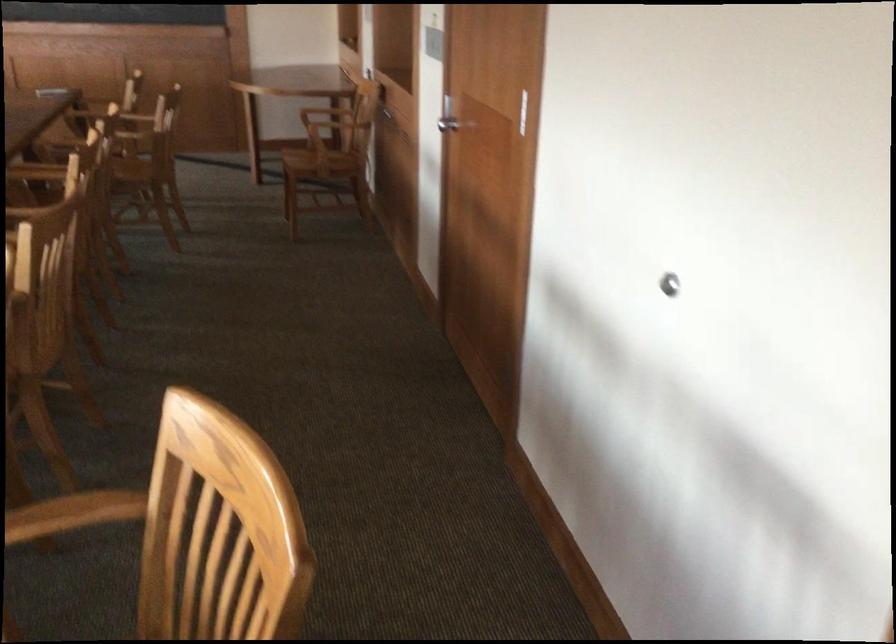
Image resolution: width=896 pixels, height=644 pixels. Describe the element at coordinates (321, 163) in the screenshot. I see `the chair sitting surface` at that location.